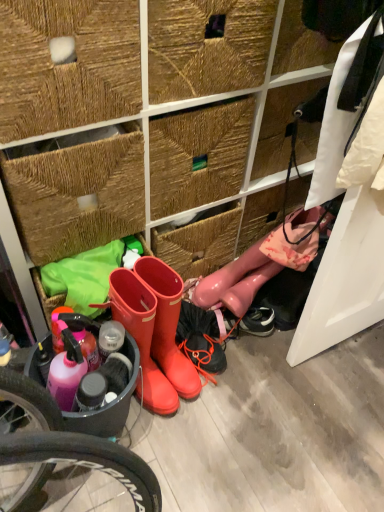
Question: Which direction should I rotate to look at rubber boots at center, the 1th footwear viewed from the left?

Choices:
 (A) right
 (B) left

Answer: (B)

Question: Is rubber boots at center, the 1th footwear viewed from the left, to the left of rubber boots at center, which appears as the second footwear when viewed from the right, from the viewer's perspective?

Choices:
 (A) no
 (B) yes

Answer: (B)

Question: Considering the relative sizes of rubber boots at center, the 3th footwear positioned from the right, and rubber boots at center, which appears as the second footwear when viewed from the right, in the image provided, is rubber boots at center, the 3th footwear positioned from the right, shorter than rubber boots at center, which appears as the second footwear when viewed from the right,?

Choices:
 (A) yes
 (B) no

Answer: (A)

Question: Is rubber boots at center, the 1th footwear viewed from the left, wider than rubber boots at center, which appears as the second footwear when viewed from the right?

Choices:
 (A) no
 (B) yes

Answer: (B)

Question: Could you tell me if rubber boots at center, the 1th footwear viewed from the left, is facing rubber boots at center, which is the 2th footwear from left to right?

Choices:
 (A) no
 (B) yes

Answer: (A)

Question: Is rubber boots at center, which appears as the second footwear when viewed from the right, located within rubber boots at center, the 3th footwear positioned from the right?

Choices:
 (A) yes
 (B) no

Answer: (B)

Question: Is rubber boots at center, the 1th footwear viewed from the left, located outside rubber boots at center, which appears as the second footwear when viewed from the right?

Choices:
 (A) no
 (B) yes

Answer: (B)

Question: Is rubber boots at center, which appears as the second footwear when viewed from the right, positioned far away from glossy pink boots at lower right, which is counted as the third footwear, starting from the left?

Choices:
 (A) no
 (B) yes

Answer: (A)

Question: Considering the relative sizes of rubber boots at center, which is the 2th footwear from left to right, and glossy pink boots at lower right, which is counted as the third footwear, starting from the left, in the image provided, is rubber boots at center, which is the 2th footwear from left to right, smaller than glossy pink boots at lower right, which is counted as the third footwear, starting from the left,?

Choices:
 (A) yes
 (B) no

Answer: (B)

Question: Is rubber boots at center, which is the 2th footwear from left to right, to the left of glossy pink boots at lower right, which is counted as the third footwear, starting from the left, from the viewer's perspective?

Choices:
 (A) no
 (B) yes

Answer: (B)

Question: Is rubber boots at center, which appears as the second footwear when viewed from the right, to the right of glossy pink boots at lower right, which is counted as the third footwear, starting from the left, from the viewer's perspective?

Choices:
 (A) yes
 (B) no

Answer: (B)

Question: Is rubber boots at center, which appears as the second footwear when viewed from the right, outside glossy pink boots at lower right, which is counted as the third footwear, starting from the left?

Choices:
 (A) yes
 (B) no

Answer: (A)

Question: Is rubber boots at center, which is the 2th footwear from left to right, taller than glossy pink boots at lower right, which is counted as the third footwear, starting from the left?

Choices:
 (A) yes
 (B) no

Answer: (A)

Question: Are rubber boots at center, which appears as the second footwear when viewed from the right, and rubber boots at center, the 1th footwear viewed from the left, making contact?

Choices:
 (A) no
 (B) yes

Answer: (B)